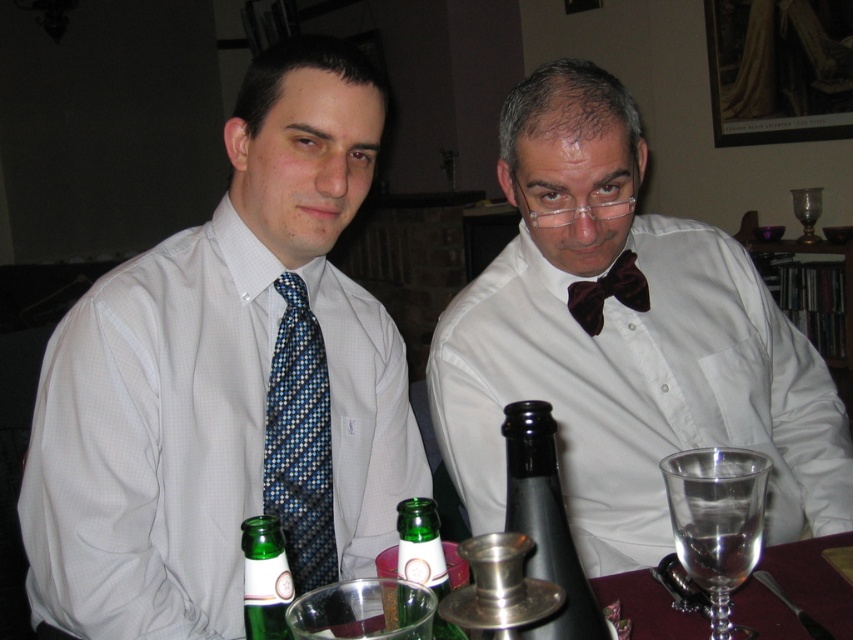
Is matte black bow tie at center positioned behind blue patterned tie at left?

Yes.

Locate an element on the screen. matte black bow tie at center is located at coordinates (624, 342).

Image resolution: width=853 pixels, height=640 pixels. In order to click on matte black bow tie at center in this screenshot , I will do `click(624, 342)`.

Is the position of matte white shirt at left more distant than that of brown velvet bow tie at center?

No, matte white shirt at left is in front of brown velvet bow tie at center.

Is matte white shirt at left positioned in front of brown velvet bow tie at center?

Yes, matte white shirt at left is in front of brown velvet bow tie at center.

Locate an element on the screen. The width and height of the screenshot is (853, 640). matte white shirt at left is located at coordinates (227, 384).

Is matte white shirt at left above clear glass wine at lower right?

Correct, matte white shirt at left is located above clear glass wine at lower right.

How much distance is there between matte white shirt at left and clear glass wine at lower right?

matte white shirt at left is 20.29 inches from clear glass wine at lower right.

Identify the location of matte white shirt at left. (227, 384).